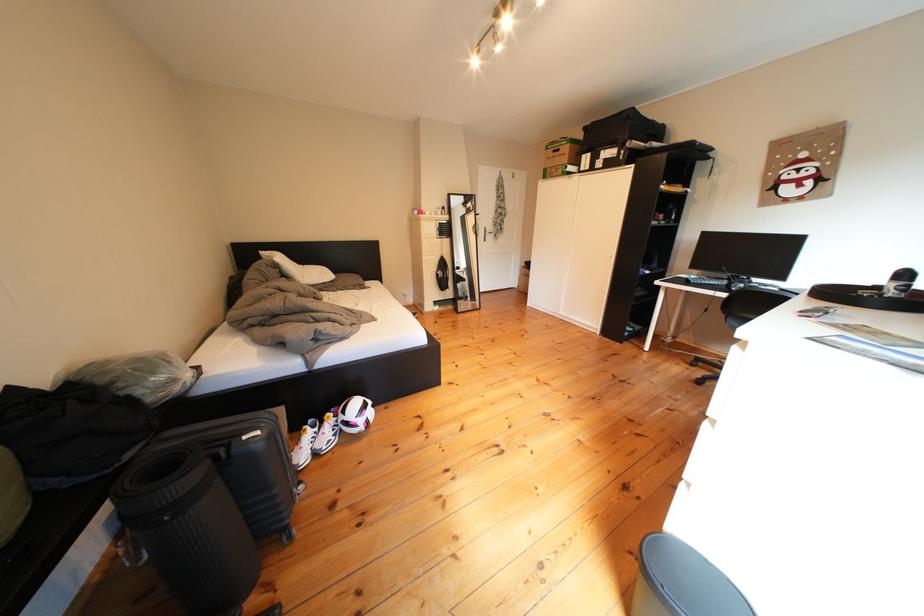
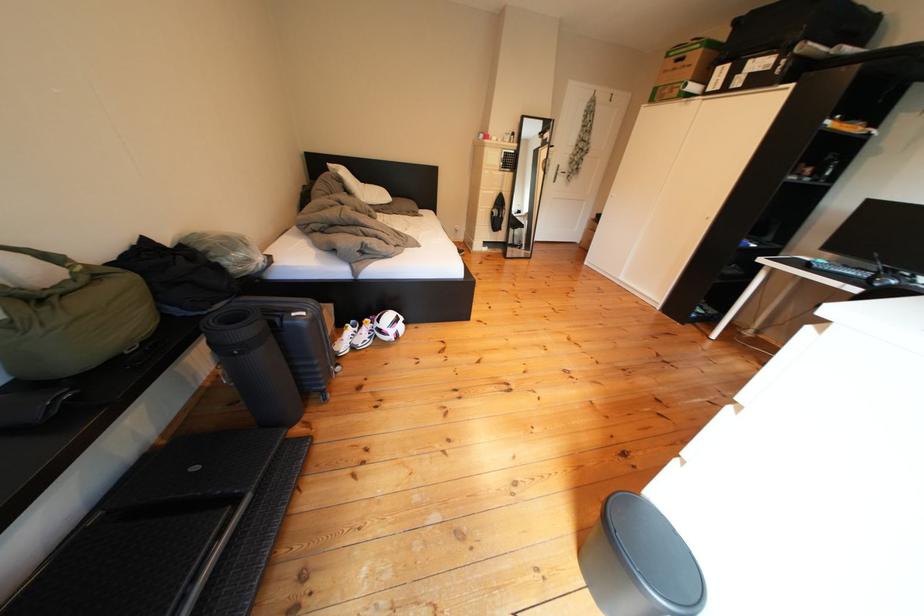
The point at (558,175) is marked in the first image. Where is the corresponding point in the second image?

(670, 95)